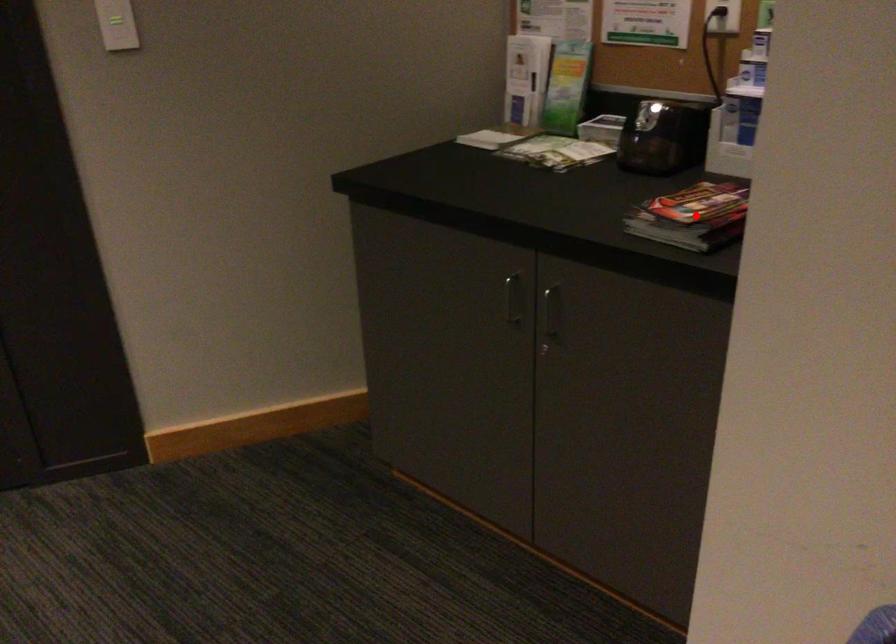
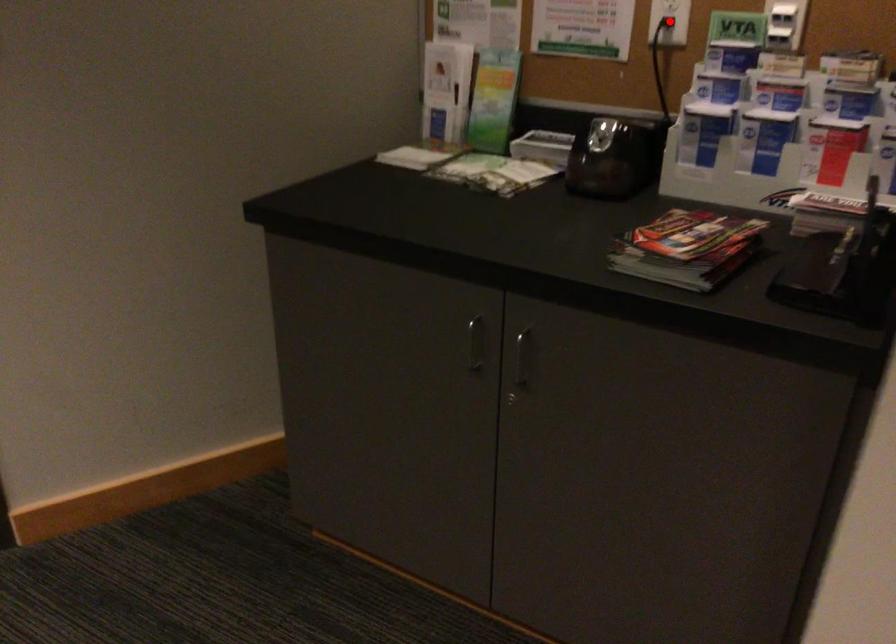
I am providing you with two images of the same scene from different viewpoints. A red point is marked on the first image and another point is marked on the second image. Do the highlighted points in image1 and image2 indicate the same real-world spot?

No